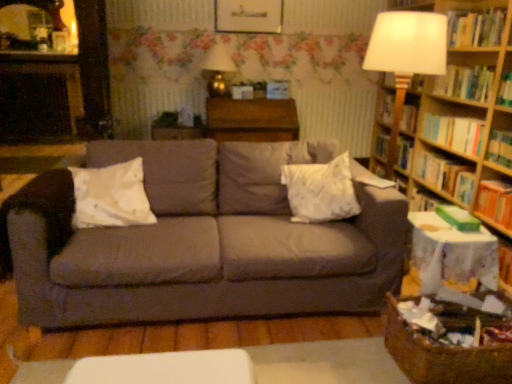
In order to click on blank area beneath green matte paperback book at right (from a real-world perspective) in this screenshot , I will do `click(454, 221)`.